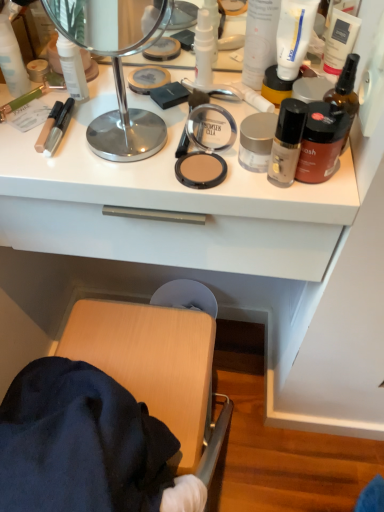
Find the location of a particular element. This screenshot has width=384, height=512. vacant point to the left of white matte tube at upper right, which is the third toiletry in right-to-left order is located at coordinates (166, 103).